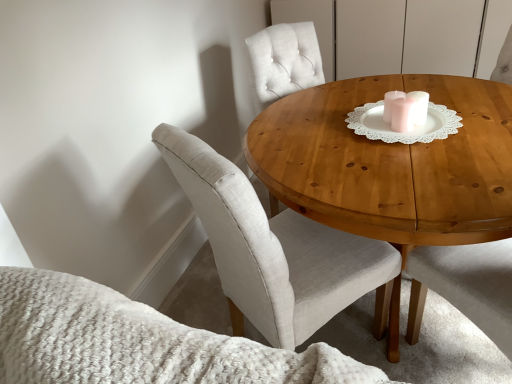
Based on the photo, what is the approximate height of white lace doily at center?

The height of white lace doily at center is 4.28 inches.

The image size is (512, 384). What are the coordinates of `wooden table at center` in the screenshot? It's located at (391, 163).

What do you see at coordinates (391, 163) in the screenshot? The height and width of the screenshot is (384, 512). I see `wooden table at center` at bounding box center [391, 163].

In order to face light beige fabric chair at center, should I rotate leftwards or rightwards?

Turn right approximately 4.259 degrees to face it.

Where is `white lace doily at center`? Image resolution: width=512 pixels, height=384 pixels. white lace doily at center is located at coordinates (405, 110).

Consider the image. How different are the orientations of white lace doily at center and wooden table at center in degrees?

The angle between the facing direction of white lace doily at center and the facing direction of wooden table at center is 84.2 degrees.

Does white lace doily at center turn towards wooden table at center?

No, white lace doily at center is not turned towards wooden table at center.

From the image's perspective, is white lace doily at center located beneath wooden table at center?

No, from the image's perspective, white lace doily at center is not beneath wooden table at center.

Find the location of a particular element. coffee table located above the light beige fabric chair at center (from the image's perspective) is located at coordinates (391, 163).

Who is bigger, light beige fabric chair at center or wooden table at center?

wooden table at center.

Which is nearer, (222, 204) or (259, 140)?

Positioned in front is point (222, 204).

Consider the image. From the image's perspective, is white lace doily at center positioned above or below light beige fabric chair at center?

Clearly, from the image's perspective, white lace doily at center is above light beige fabric chair at center.

In the scene shown: Is white lace doily at center inside or outside of light beige fabric chair at center?

white lace doily at center exists outside the volume of light beige fabric chair at center.

Is white lace doily at center closer to the viewer compared to light beige fabric chair at center?

No, white lace doily at center is behind light beige fabric chair at center.

Considering the positions of points (412, 93) and (254, 247), is point (412, 93) farther from camera compared to point (254, 247)?

That is True.

Between wooden table at center and light beige fabric chair at center, which one has more height?

light beige fabric chair at center.

Is wooden table at center not near light beige fabric chair at center?

That's not correct — wooden table at center is a little close to light beige fabric chair at center.

Considering the sizes of objects wooden table at center and light beige fabric chair at center in the image provided, who is wider, wooden table at center or light beige fabric chair at center?

Wider between the two is wooden table at center.

Is light beige fabric chair at center located within wooden table at center?

Yes, light beige fabric chair at center is surrounded by wooden table at center.

Can you confirm if light beige fabric chair at center is positioned to the right of white lace doily at center?

No, light beige fabric chair at center is not to the right of white lace doily at center.

Considering the sizes of objects light beige fabric chair at center and white lace doily at center in the image provided, who is bigger, light beige fabric chair at center or white lace doily at center?

light beige fabric chair at center is bigger.

Is light beige fabric chair at center beside white lace doily at center?

No, light beige fabric chair at center is not next to white lace doily at center.

Where is `chair that appears below the white lace doily at center (from a real-world perspective)`? chair that appears below the white lace doily at center (from a real-world perspective) is located at coordinates (275, 250).

Based on their positions, is wooden table at center located to the left or right of white lace doily at center?

Based on their positions, wooden table at center is located to the right of white lace doily at center.

From a real-world perspective, which is physically below, wooden table at center or white lace doily at center?

wooden table at center.

Is wooden table at center not inside white lace doily at center?

Yes.

The height and width of the screenshot is (384, 512). In order to click on coffee table below the white lace doily at center (from the image's perspective) in this screenshot , I will do `click(391, 163)`.

Where is `chair above the wooden table at center (from a real-world perspective)`? chair above the wooden table at center (from a real-world perspective) is located at coordinates (275, 250).

Which object lies nearer to the anchor point white lace doily at center, wooden table at center or light beige fabric chair at center?

wooden table at center is positioned closer to the anchor white lace doily at center.

From the image, which object appears to be farther from wooden table at center, light beige fabric chair at center or white lace doily at center?

light beige fabric chair at center.

From the image, which object appears to be farther from light beige fabric chair at center, white lace doily at center or wooden table at center?

white lace doily at center lies further to light beige fabric chair at center than the other object.

When comparing their distances from wooden table at center, does white lace doily at center or light beige fabric chair at center seem further?

Based on the image, light beige fabric chair at center appears to be further to wooden table at center.

Based on the photo, from the image, which object appears to be nearer to white lace doily at center, light beige fabric chair at center or wooden table at center?

wooden table at center is closer to white lace doily at center.

Based on their spatial positions, is wooden table at center or white lace doily at center further from light beige fabric chair at center?

white lace doily at center is positioned further to the anchor light beige fabric chair at center.

Find the location of a particular element. chair between wooden table at center and white lace doily at center in the front-back direction is located at coordinates pos(275,250).